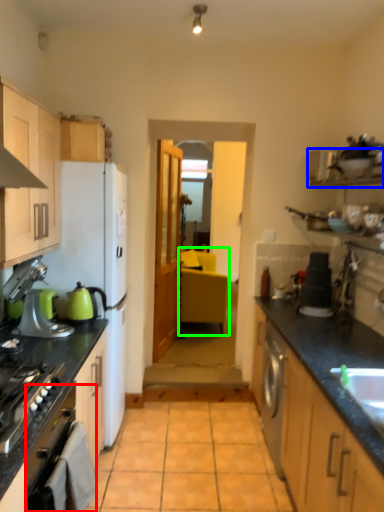
Question: Estimate the real-world distances between objects in this image. Which object is farther from oven (highlighted by a red box), shelf (highlighted by a blue box) or chair (highlighted by a green box)?

Choices:
 (A) shelf
 (B) chair

Answer: (B)